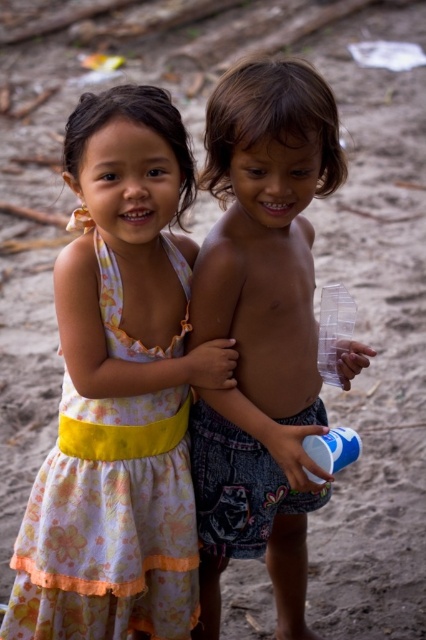
You are a parent at the beach and want to store a beach umbrella. You have two options to place it next to the shiny plastic cup at center and the floral cotton dress at left. Which object should you choose to ensure the umbrella won not block the view of the ocean?

The shiny plastic cup at center is much taller than the floral cotton dress at left. To avoid blocking the ocean view, place the umbrella next to the shorter object, which is the floral cotton dress at left.

You are a photographer trying to capture both children in the scene. Since you want to ensure the floral cotton dress at center and the floral cotton dress at left are both clearly visible, which dress should you focus on first to ensure proper exposure, considering their sizes?

The floral cotton dress at center is larger in size than the floral cotton dress at left. Therefore, you should focus on the floral cotton dress at center first to ensure proper exposure, as its larger size may require more light adjustment.